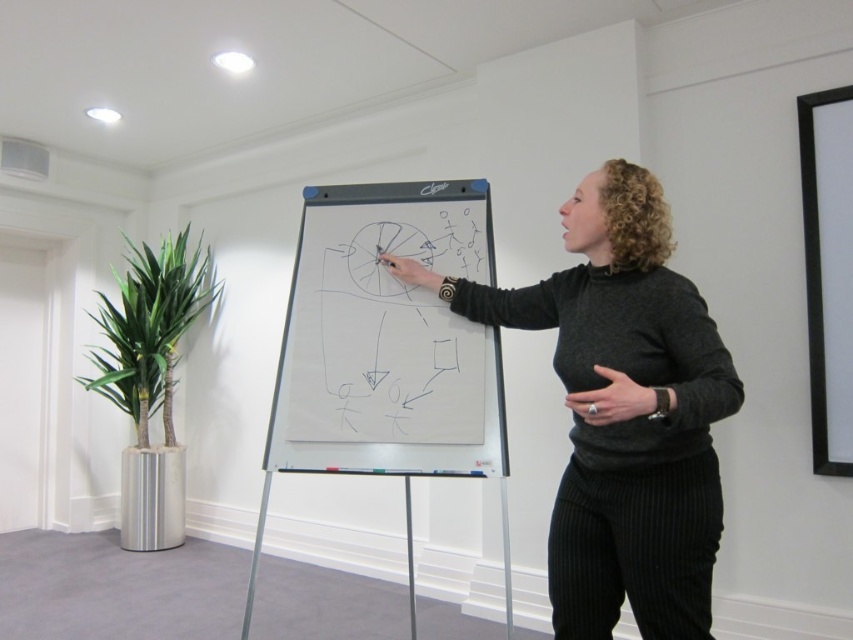
Between dark gray sweater at center and whiteboard at center, which one has more height?

Standing taller between the two is dark gray sweater at center.

From the picture: Is dark gray sweater at center below whiteboard at center?

Indeed, dark gray sweater at center is positioned under whiteboard at center.

Measure the distance between point (461,289) and camera.

A: Point (461,289) is 7.24 feet from camera.

At what (x,y) coordinates should I click in order to perform the action: click on dark gray sweater at center. Please return your answer as a coordinate pair (x, y). Looking at the image, I should click on (622, 410).